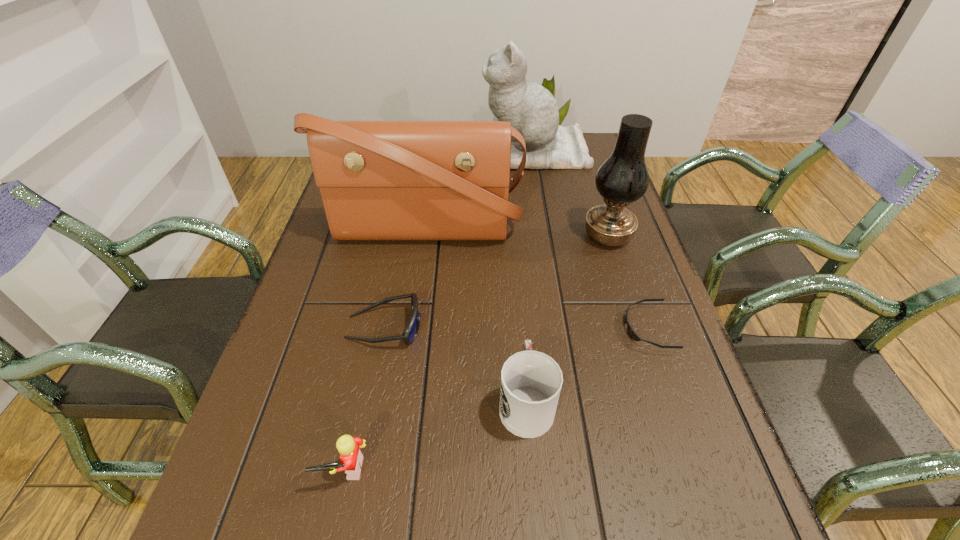
I want to click on vacant position located on the front-facing side of the right sunglasses, so click(x=535, y=328).

Locate an element on the screen. This screenshot has width=960, height=540. free region located on the front-facing side of the right sunglasses is located at coordinates (587, 328).

Find the location of a particular element. The image size is (960, 540). object situated at the far edge is located at coordinates (531, 109).

Find the location of a particular element. satchel that is at the left edge is located at coordinates (379, 180).

The width and height of the screenshot is (960, 540). What are the coordinates of `Lego at the left edge` in the screenshot? It's located at (351, 458).

The height and width of the screenshot is (540, 960). What are the coordinates of `sunglasses that is at the left edge` in the screenshot? It's located at (412, 329).

At what (x,y) coordinates should I click in order to perform the action: click on cat positioned at the right edge. Please return your answer as a coordinate pair (x, y). Image resolution: width=960 pixels, height=540 pixels. Looking at the image, I should click on (531, 109).

Find the location of a particular element. The height and width of the screenshot is (540, 960). oil lamp at the right edge is located at coordinates (623, 178).

You are a GUI agent. You are given a task and a screenshot of the screen. Output one action in this format:
    pyautogui.click(x=<x>, y=<y>)
    Task: Click on the sunglasses that is positioned at the right edge
    The width and height of the screenshot is (960, 540).
    Given the screenshot: What is the action you would take?
    pyautogui.click(x=630, y=331)

I want to click on object at the far right corner, so click(x=531, y=109).